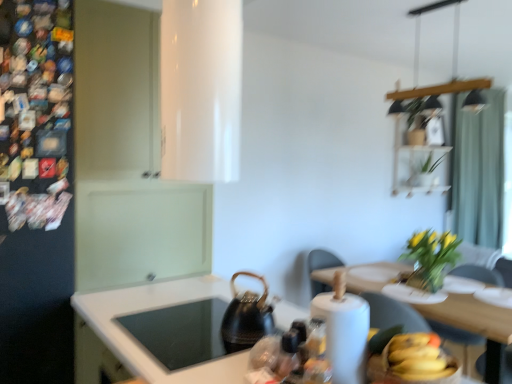
Question: Is teal fabric curtain at upper right to the right of green matte plant at upper right, which is counted as the first plant, starting from the back, from the viewer's perspective?

Choices:
 (A) yes
 (B) no

Answer: (A)

Question: Can you confirm if teal fabric curtain at upper right is shorter than green matte plant at upper right, which is counted as the first plant, starting from the back?

Choices:
 (A) yes
 (B) no

Answer: (B)

Question: From the image's perspective, is teal fabric curtain at upper right located above green matte plant at upper right, which is counted as the first plant, starting from the back?

Choices:
 (A) yes
 (B) no

Answer: (B)

Question: Considering the relative sizes of teal fabric curtain at upper right and green matte plant at upper right, marked as the second plant in a bottom-to-top arrangement, in the image provided, is teal fabric curtain at upper right bigger than green matte plant at upper right, marked as the second plant in a bottom-to-top arrangement,?

Choices:
 (A) yes
 (B) no

Answer: (A)

Question: Is teal fabric curtain at upper right in contact with green matte plant at upper right, the 1th plant from the right?

Choices:
 (A) yes
 (B) no

Answer: (B)

Question: Does teal fabric curtain at upper right contain green matte plant at upper right, the 1th plant from the right?

Choices:
 (A) yes
 (B) no

Answer: (B)

Question: From the image's perspective, is light brown wooden chair at right beneath white glossy sink at lower center?

Choices:
 (A) no
 (B) yes

Answer: (B)

Question: Is white glossy sink at lower center at the back of light brown wooden chair at right?

Choices:
 (A) yes
 (B) no

Answer: (B)

Question: Can you see light brown wooden chair at right touching white glossy sink at lower center?

Choices:
 (A) no
 (B) yes

Answer: (A)

Question: Are light brown wooden chair at right and white glossy sink at lower center far apart?

Choices:
 (A) yes
 (B) no

Answer: (A)

Question: From a real-world perspective, is light brown wooden chair at right on top of white glossy sink at lower center?

Choices:
 (A) yes
 (B) no

Answer: (B)

Question: From a real-world perspective, does light brown wooden chair at right sit lower than white glossy sink at lower center?

Choices:
 (A) yes
 (B) no

Answer: (A)

Question: From a real-world perspective, is white paper towel at lower right over wooden dining table at lower right?

Choices:
 (A) yes
 (B) no

Answer: (A)